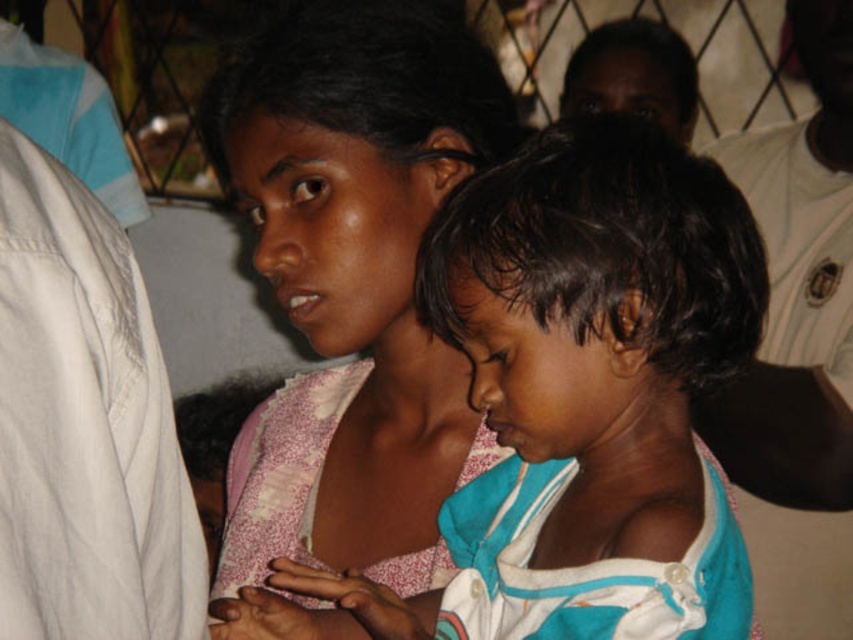
Question: Which of the following is the farthest from the observer?

Choices:
 (A) (450, 444)
 (B) (751, 349)

Answer: (A)

Question: Which of the following is the farthest from the observer?

Choices:
 (A) (496, 195)
 (B) (315, 376)

Answer: (B)

Question: Is light blue fabric shirt at center to the left of pink fabric at center from the viewer's perspective?

Choices:
 (A) yes
 (B) no

Answer: (B)

Question: Which object is closer to the camera taking this photo?

Choices:
 (A) light blue fabric shirt at center
 (B) pink fabric at center

Answer: (A)

Question: Observing the image, what is the correct spatial positioning of light blue fabric shirt at center in reference to pink fabric at center?

Choices:
 (A) right
 (B) left

Answer: (A)

Question: Can you confirm if light blue fabric shirt at center is smaller than pink fabric at center?

Choices:
 (A) yes
 (B) no

Answer: (A)